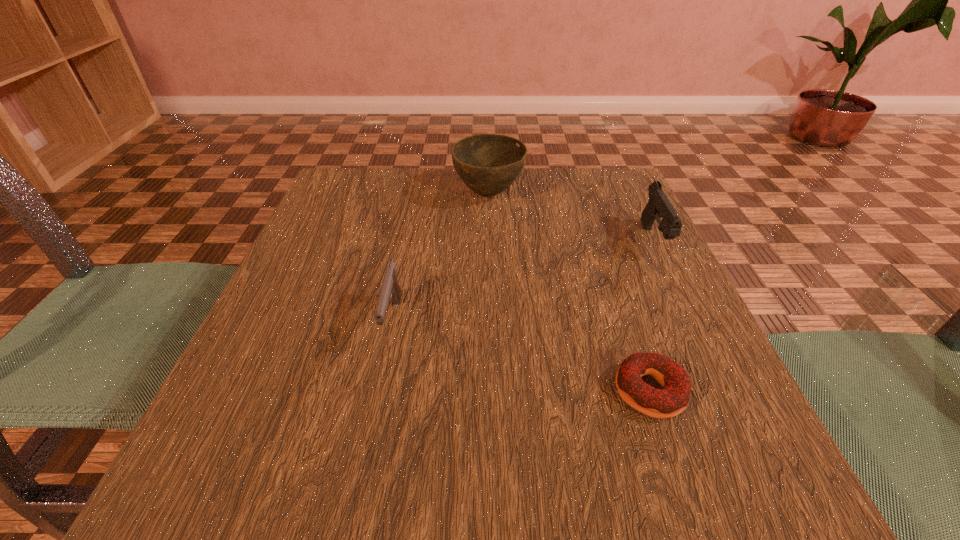
Locate an element on the screen. This screenshot has width=960, height=540. vacant area between the shortest object and the third tallest object is located at coordinates (521, 356).

This screenshot has width=960, height=540. In order to click on free spot between the second nearest object and the rightmost object in this screenshot , I will do `click(523, 281)`.

Select which object appears as the second closest to the third object from left to right. Please provide its 2D coordinates. Your answer should be formatted as a tuple, i.e. [(x, y)], where the tuple contains the x and y coordinates of a point satisfying the conditions above.

[(390, 290)]

Find the location of a particular element. object that is the closest to the right pistol is located at coordinates (488, 164).

Identify the location of free point that satisfies the following two spatial constraints: 1. at the barrel of the third tallest object; 2. on the right side of the nearest object. The width and height of the screenshot is (960, 540). (378, 391).

The width and height of the screenshot is (960, 540). What are the coordinates of `blank space that satisfies the following two spatial constraints: 1. on the front side of the nearest object; 2. on the right side of the bowl` in the screenshot? It's located at (494, 391).